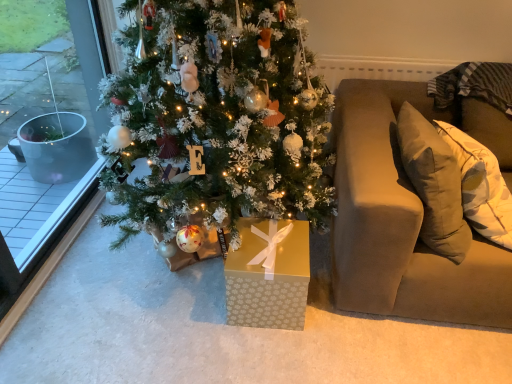
Question: Is gold paper gift box at center inside the boundaries of clear glass window at left, or outside?

Choices:
 (A) inside
 (B) outside

Answer: (B)

Question: From the image's perspective, is gold paper gift box at center above or below clear glass window at left?

Choices:
 (A) below
 (B) above

Answer: (A)

Question: Which object is the farthest from the clear glass window at left?

Choices:
 (A) gold paper gift box at center
 (B) white frosted christmas tree at center
 (C) beige fabric couch at right

Answer: (C)

Question: Which is nearer to the gold paper gift box at center?

Choices:
 (A) clear glass window at left
 (B) beige fabric couch at right
 (C) white frosted christmas tree at center

Answer: (B)